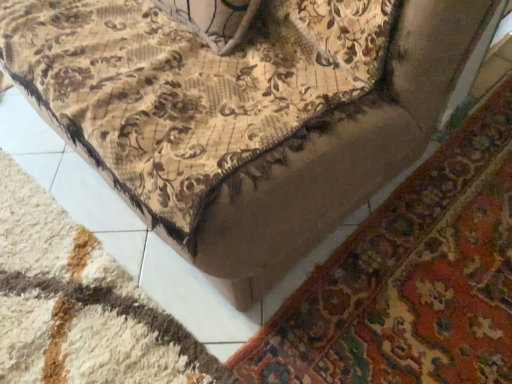
Question: Does beige textured mat at lower center, positioned as the 2th mat in right-to-left order, appear on the right side of floral fabric mat at lower right, which ranks as the first mat in right-to-left order?

Choices:
 (A) no
 (B) yes

Answer: (A)

Question: From the image's perspective, is beige textured mat at lower center, positioned as the 1th mat in left-to-right order, on top of floral fabric mat at lower right, which ranks as the first mat in right-to-left order?

Choices:
 (A) yes
 (B) no

Answer: (B)

Question: Considering the relative sizes of beige textured mat at lower center, positioned as the 2th mat in right-to-left order, and floral fabric mat at lower right, which is the 2th mat from left to right, in the image provided, is beige textured mat at lower center, positioned as the 2th mat in right-to-left order, smaller than floral fabric mat at lower right, which is the 2th mat from left to right,?

Choices:
 (A) yes
 (B) no

Answer: (B)

Question: Considering the relative sizes of beige textured mat at lower center, positioned as the 2th mat in right-to-left order, and floral fabric mat at lower right, which is the 2th mat from left to right, in the image provided, is beige textured mat at lower center, positioned as the 2th mat in right-to-left order, wider than floral fabric mat at lower right, which is the 2th mat from left to right,?

Choices:
 (A) no
 (B) yes

Answer: (A)

Question: From a real-world perspective, is beige textured mat at lower center, positioned as the 2th mat in right-to-left order, over floral fabric mat at lower right, which ranks as the first mat in right-to-left order?

Choices:
 (A) no
 (B) yes

Answer: (B)

Question: Is beige textured mat at lower center, positioned as the 2th mat in right-to-left order, at the left side of floral fabric mat at lower right, which ranks as the first mat in right-to-left order?

Choices:
 (A) yes
 (B) no

Answer: (A)

Question: Can you confirm if floral fabric mat at lower right, which is the 2th mat from left to right, is bigger than beige textured mat at lower center, positioned as the 2th mat in right-to-left order?

Choices:
 (A) yes
 (B) no

Answer: (B)

Question: Is floral fabric mat at lower right, which is the 2th mat from left to right, far away from beige textured mat at lower center, positioned as the 1th mat in left-to-right order?

Choices:
 (A) yes
 (B) no

Answer: (B)

Question: From a real-world perspective, is floral fabric mat at lower right, which ranks as the first mat in right-to-left order, located beneath beige textured mat at lower center, positioned as the 1th mat in left-to-right order?

Choices:
 (A) yes
 (B) no

Answer: (A)

Question: Is the surface of floral fabric mat at lower right, which ranks as the first mat in right-to-left order, in direct contact with beige textured mat at lower center, positioned as the 1th mat in left-to-right order?

Choices:
 (A) yes
 (B) no

Answer: (B)

Question: Is floral fabric mat at lower right, which is the 2th mat from left to right, taller than beige textured mat at lower center, positioned as the 2th mat in right-to-left order?

Choices:
 (A) yes
 (B) no

Answer: (B)

Question: Is floral fabric mat at lower right, which is the 2th mat from left to right, turned away from beige textured mat at lower center, positioned as the 2th mat in right-to-left order?

Choices:
 (A) yes
 (B) no

Answer: (B)

Question: From the image's perspective, is beige textured mat at lower center, positioned as the 1th mat in left-to-right order, above or below floral fabric mat at lower right, which ranks as the first mat in right-to-left order?

Choices:
 (A) above
 (B) below

Answer: (B)